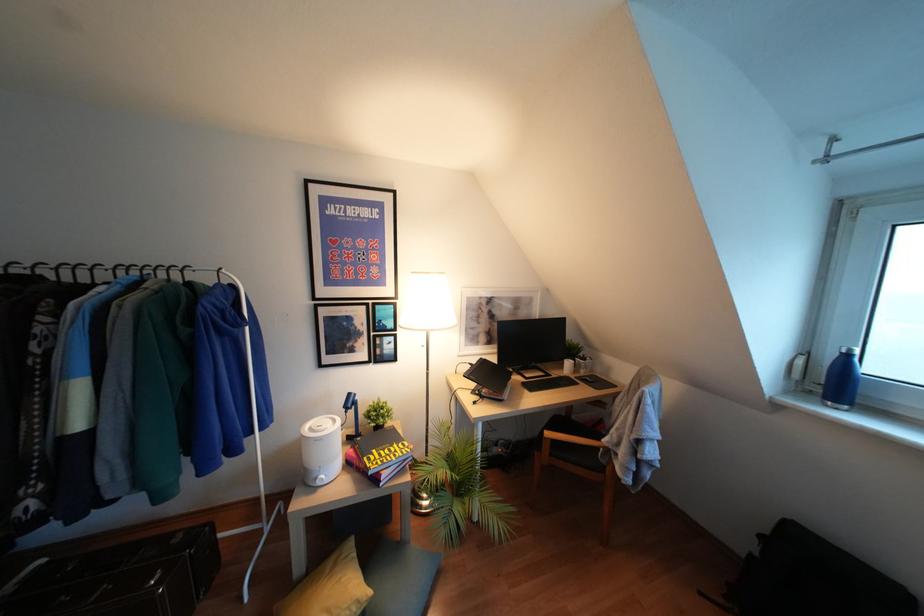
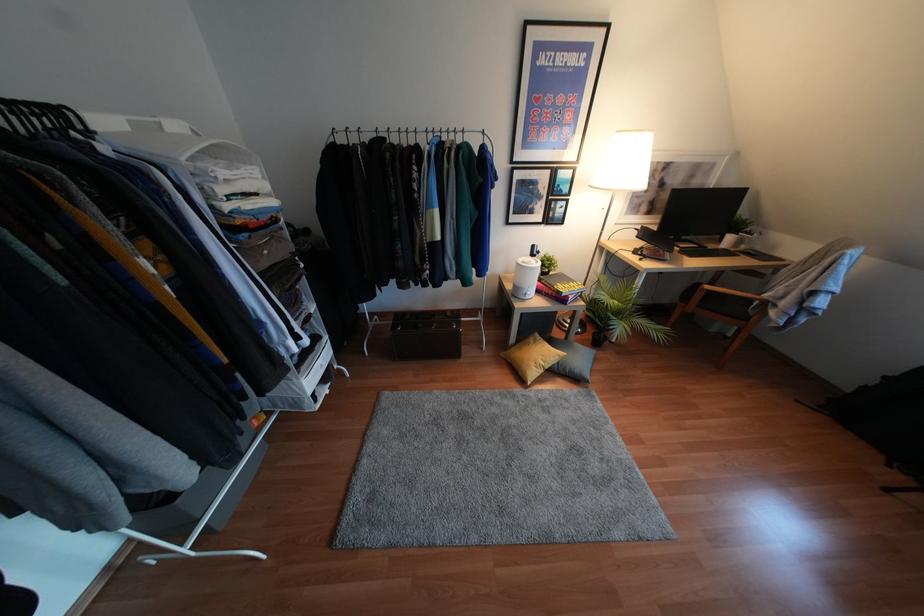
Locate, in the second image, the point that corresponds to [319,483] in the first image.

(526, 297)